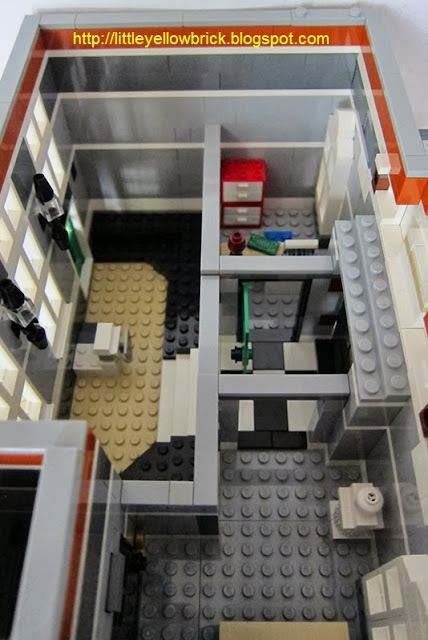
Identify the location of beige floor. This screenshot has height=640, width=428. (114, 393).